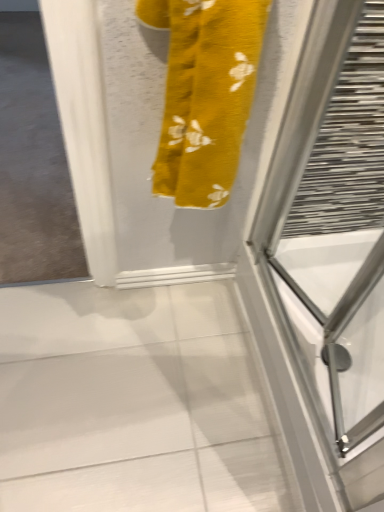
Question: Is the depth of transparent glass screen door at right less than that of yellow fabric towel at upper center?

Choices:
 (A) yes
 (B) no

Answer: (B)

Question: From the image's perspective, is transparent glass screen door at right above yellow fabric towel at upper center?

Choices:
 (A) yes
 (B) no

Answer: (B)

Question: Does transparent glass screen door at right have a larger size compared to yellow fabric towel at upper center?

Choices:
 (A) yes
 (B) no

Answer: (A)

Question: Is transparent glass screen door at right positioned with its back to yellow fabric towel at upper center?

Choices:
 (A) no
 (B) yes

Answer: (A)

Question: Is transparent glass screen door at right positioned beyond the bounds of yellow fabric towel at upper center?

Choices:
 (A) yes
 (B) no

Answer: (A)

Question: Can you confirm if transparent glass screen door at right is shorter than yellow fabric towel at upper center?

Choices:
 (A) no
 (B) yes

Answer: (B)

Question: Is yellow fabric towel at upper center placed right next to transparent glass screen door at right?

Choices:
 (A) yes
 (B) no

Answer: (B)

Question: Are yellow fabric towel at upper center and transparent glass screen door at right located far from each other?

Choices:
 (A) yes
 (B) no

Answer: (B)

Question: Can you confirm if yellow fabric towel at upper center is bigger than transparent glass screen door at right?

Choices:
 (A) yes
 (B) no

Answer: (B)

Question: Is yellow fabric towel at upper center smaller than transparent glass screen door at right?

Choices:
 (A) no
 (B) yes

Answer: (B)

Question: Considering the relative sizes of yellow fabric towel at upper center and transparent glass screen door at right in the image provided, is yellow fabric towel at upper center taller than transparent glass screen door at right?

Choices:
 (A) no
 (B) yes

Answer: (B)

Question: From a real-world perspective, is yellow fabric towel at upper center under transparent glass screen door at right?

Choices:
 (A) yes
 (B) no

Answer: (B)

Question: Is transparent glass screen door at right in front of or behind yellow fabric towel at upper center in the image?

Choices:
 (A) behind
 (B) front

Answer: (A)